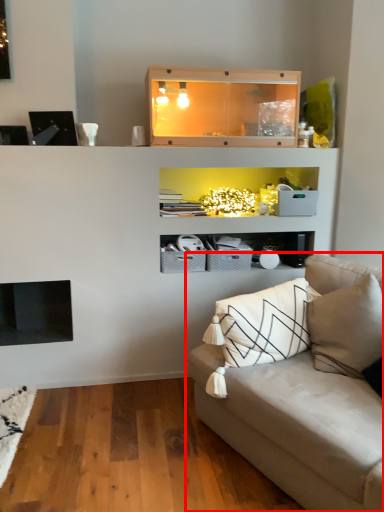
Question: Where is studio couch (annotated by the red box) located in relation to shelf in the image?

Choices:
 (A) right
 (B) left

Answer: (A)